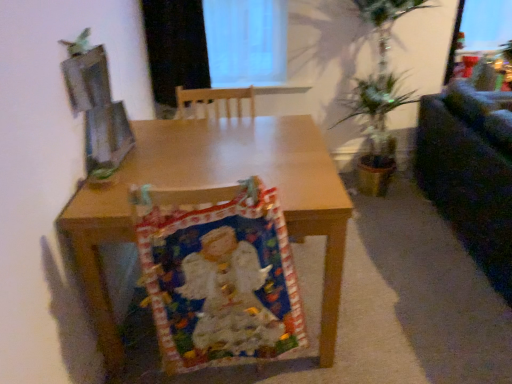
Question: Does point (197, 13) appear closer or farther from the camera than point (190, 274)?

Choices:
 (A) closer
 (B) farther

Answer: (B)

Question: In the image, is black matte curtain at upper center on the left side or the right side of multicolored fabric at center?

Choices:
 (A) left
 (B) right

Answer: (A)

Question: Considering the real-world distances, which object is farthest from the wooden desk at center?

Choices:
 (A) multicolored fabric at center
 (B) black matte curtain at upper center
 (C) dark fabric couch at right

Answer: (C)

Question: Considering the real-world distances, which object is farthest from the dark fabric couch at right?

Choices:
 (A) multicolored fabric at center
 (B) black matte curtain at upper center
 (C) wooden desk at center

Answer: (B)